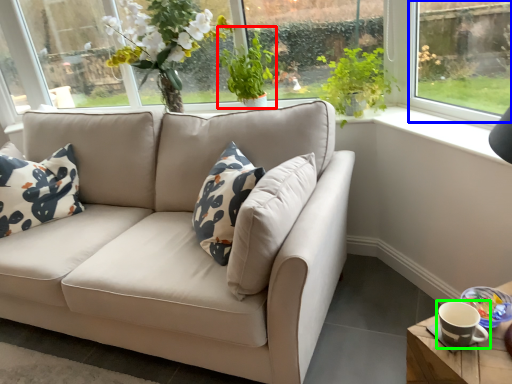
Question: Which object is the closest to the plant (highlighted by a red box)? Choose among these: window (highlighted by a blue box) or coffee cup (highlighted by a green box).

Choices:
 (A) window
 (B) coffee cup

Answer: (A)